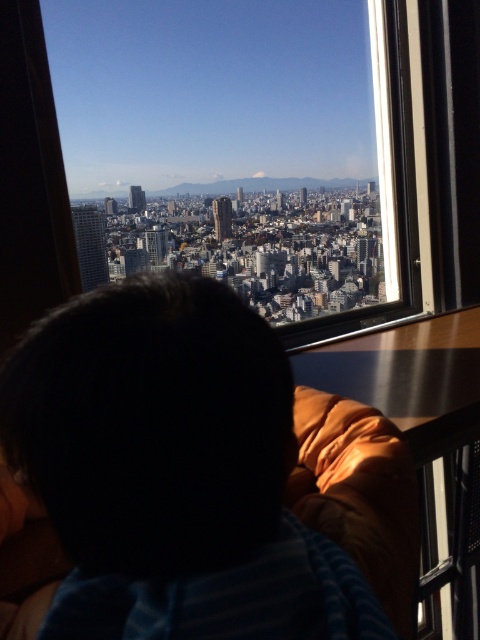
Question: Considering the relative positions of transparent glass window at center and dark hair at center in the image provided, where is transparent glass window at center located with respect to dark hair at center?

Choices:
 (A) above
 (B) below

Answer: (A)

Question: Can you confirm if transparent glass window at center is thinner than dark hair at center?

Choices:
 (A) no
 (B) yes

Answer: (A)

Question: In this image, where is transparent glass window at center located relative to dark hair at center?

Choices:
 (A) above
 (B) below

Answer: (A)

Question: Which of the following is the farthest from the observer?

Choices:
 (A) (367, 588)
 (B) (156, 51)

Answer: (B)

Question: Which of the following is the closest to the observer?

Choices:
 (A) transparent glass window at center
 (B) dark hair at center

Answer: (B)